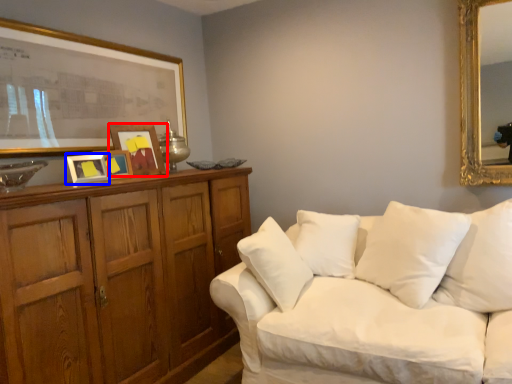
Question: Which of the following is the closest to the observer, picture frame (highlighted by a red box) or picture frame (highlighted by a blue box)?

Choices:
 (A) picture frame
 (B) picture frame

Answer: (B)